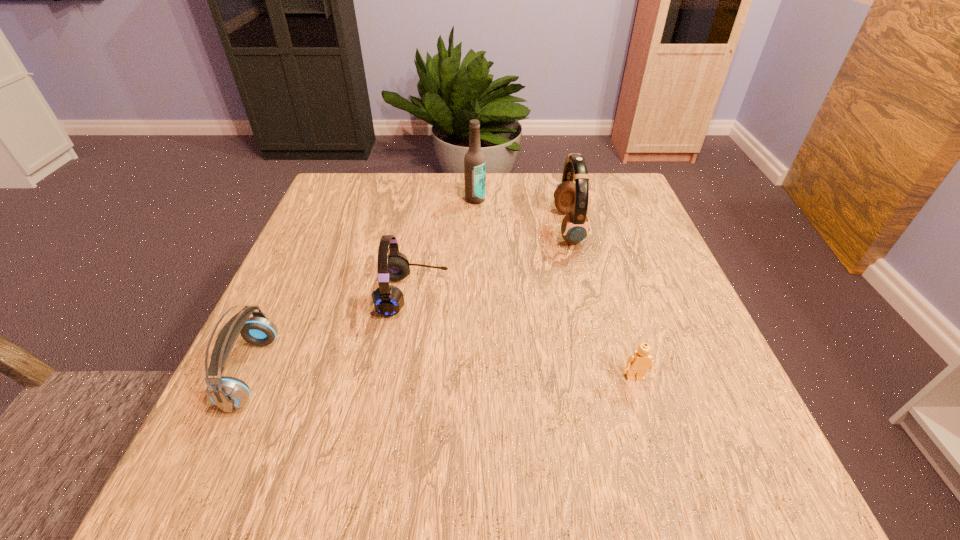
Identify the location of free space at the far edge of the desktop. Image resolution: width=960 pixels, height=540 pixels. (406, 220).

The image size is (960, 540). I want to click on free space at the near edge of the desktop, so click(x=396, y=445).

The width and height of the screenshot is (960, 540). I want to click on blank space at the left edge of the desktop, so click(x=326, y=337).

I want to click on vacant area at the right edge, so click(x=629, y=338).

Where is `vacant position at the far left corner of the desktop`? The height and width of the screenshot is (540, 960). vacant position at the far left corner of the desktop is located at coordinates (354, 207).

Identify the location of blank area at the far right corner. The width and height of the screenshot is (960, 540). (620, 181).

The image size is (960, 540). In the image, there is a desktop. Find the location of `vacant space at the near right corner`. vacant space at the near right corner is located at coordinates (724, 448).

Where is `empty space between the Lego and the beer bottle`? empty space between the Lego and the beer bottle is located at coordinates (555, 289).

The image size is (960, 540). I want to click on vacant area that lies between the Lego and the second farthest object, so click(602, 303).

Find the location of a particular element. vacant space that is in between the farthest object and the Lego is located at coordinates pos(555,289).